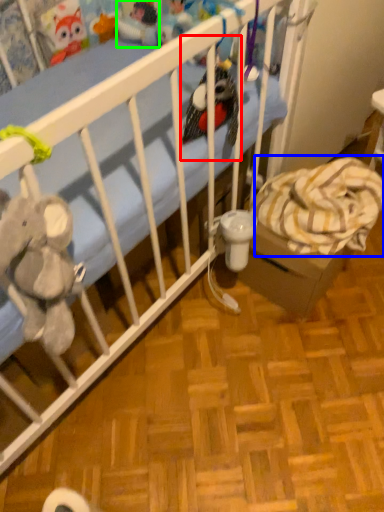
Question: Which object is the closest to the toy (highlighted by a red box)? Choose among these: blanket (highlighted by a blue box) or toy (highlighted by a green box).

Choices:
 (A) blanket
 (B) toy

Answer: (A)